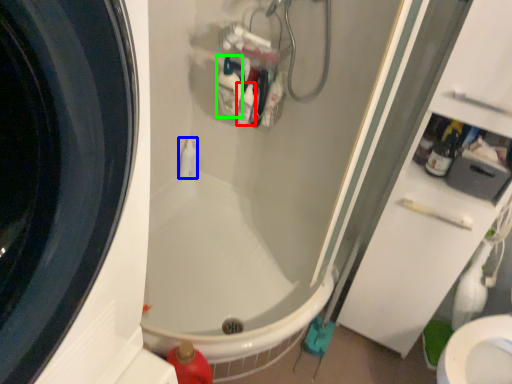
Question: Which object is positioned closest to cleaning product (highlighted by a red box)? Select from toiletry (highlighted by a blue box) and cleaning product (highlighted by a green box).

Choices:
 (A) toiletry
 (B) cleaning product

Answer: (B)